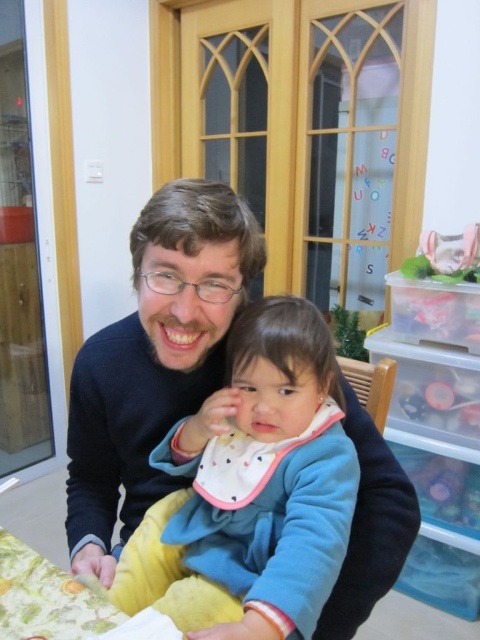
Question: Is blue fleece jacket at center positioned behind floral fabric table at lower left?

Choices:
 (A) no
 (B) yes

Answer: (A)

Question: Is blue fleece jacket at center to the left of floral fabric table at lower left from the viewer's perspective?

Choices:
 (A) yes
 (B) no

Answer: (B)

Question: Can you confirm if blue fleece jacket at center is positioned to the right of floral fabric table at lower left?

Choices:
 (A) yes
 (B) no

Answer: (A)

Question: Which point appears closest to the camera in this image?

Choices:
 (A) (184, 460)
 (B) (8, 584)

Answer: (B)